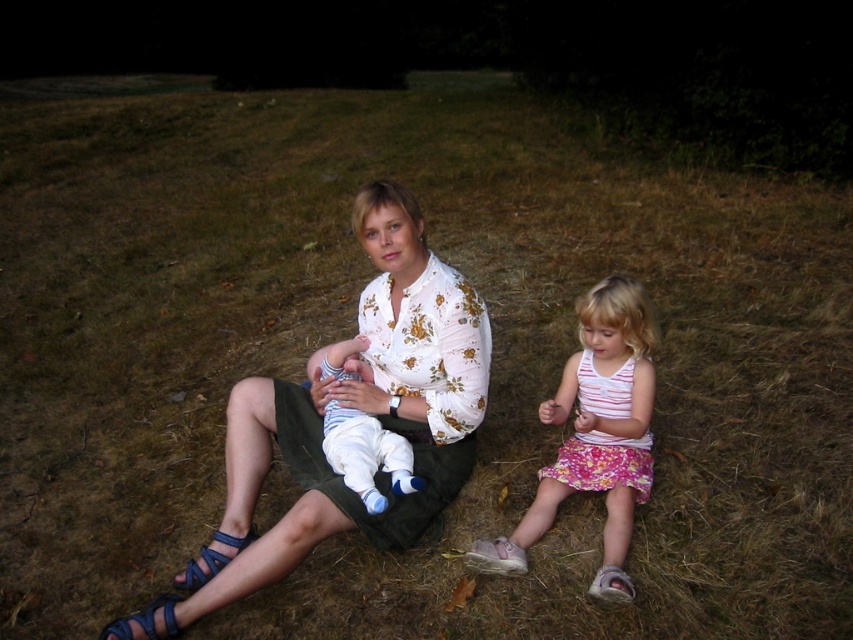
Question: Is floral cotton blouse at center above pink floral dress at lower right?

Choices:
 (A) no
 (B) yes

Answer: (B)

Question: Which of the following is the closest to the observer?

Choices:
 (A) floral cotton blouse at center
 (B) white cotton baby at center

Answer: (A)

Question: Among these objects, which one is farthest from the camera?

Choices:
 (A) pink floral dress at lower right
 (B) white cotton baby at center

Answer: (B)

Question: Is floral cotton blouse at center above pink floral dress at lower right?

Choices:
 (A) no
 (B) yes

Answer: (B)

Question: Is floral cotton blouse at center positioned before pink floral dress at lower right?

Choices:
 (A) yes
 (B) no

Answer: (A)

Question: Which object is closer to the camera taking this photo?

Choices:
 (A) floral cotton blouse at center
 (B) white cotton baby at center

Answer: (A)